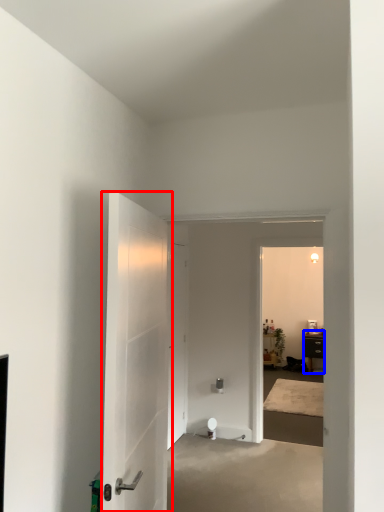
Question: Which point is closer to the camera, door (highlighted by a red box) or furniture (highlighted by a blue box)?

Choices:
 (A) door
 (B) furniture

Answer: (A)